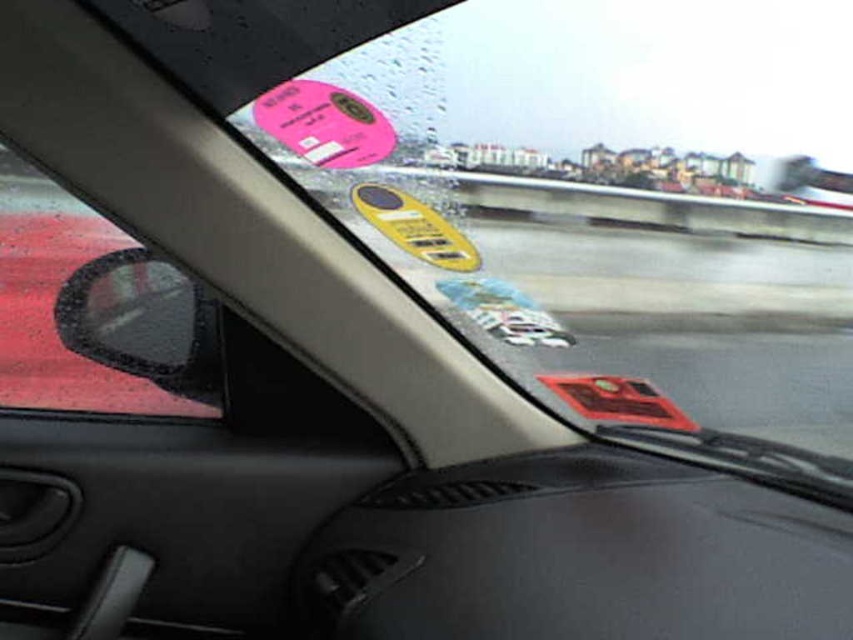
Question: Is the position of pink glossy sticker at upper center less distant than that of red matte sticker at center?

Choices:
 (A) yes
 (B) no

Answer: (A)

Question: Which is farther from the yellow matte keychain at center?

Choices:
 (A) transparent rubber side mirror at left
 (B) red matte sticker at center
 (C) pink glossy sticker at upper center

Answer: (B)

Question: Which of the following is the farthest from the observer?

Choices:
 (A) (372, 196)
 (B) (343, 131)

Answer: (A)

Question: In this image, where is yellow matte keychain at center located relative to red matte sticker at center?

Choices:
 (A) left
 (B) right

Answer: (A)

Question: From the image, what is the correct spatial relationship of transparent rubber side mirror at left in relation to red matte sticker at center?

Choices:
 (A) above
 (B) below

Answer: (A)

Question: Which object is farther from the camera taking this photo?

Choices:
 (A) yellow matte keychain at center
 (B) transparent rubber side mirror at left

Answer: (B)